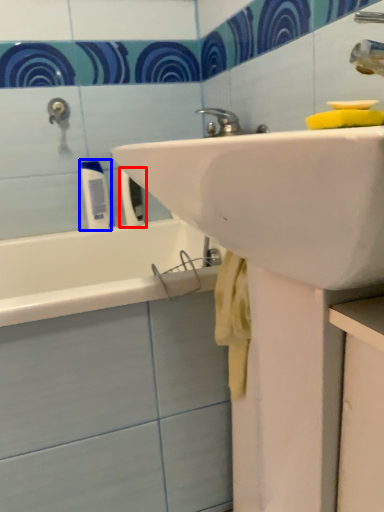
Question: Among these objects, which one is farthest to the camera, toiletry (highlighted by a red box) or toiletry (highlighted by a blue box)?

Choices:
 (A) toiletry
 (B) toiletry

Answer: (A)